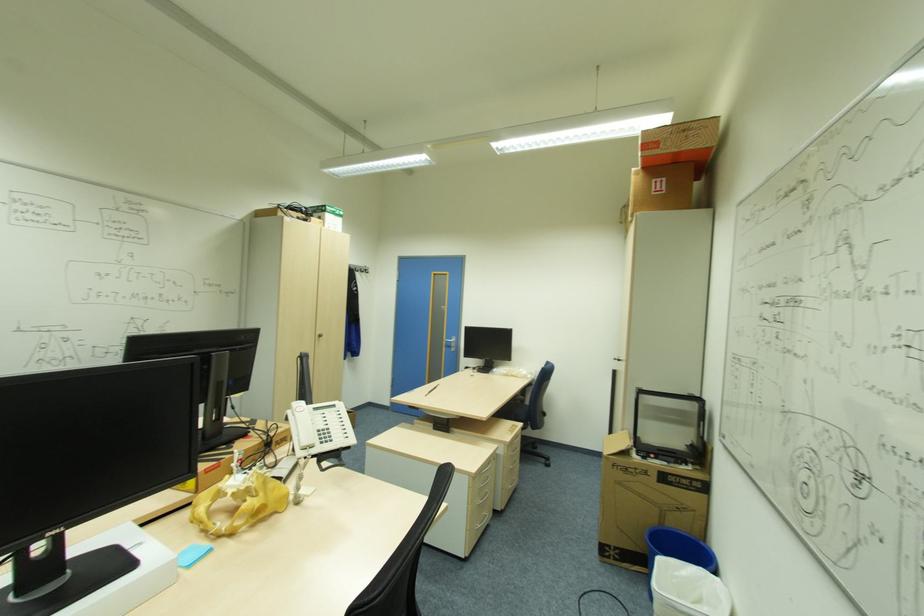
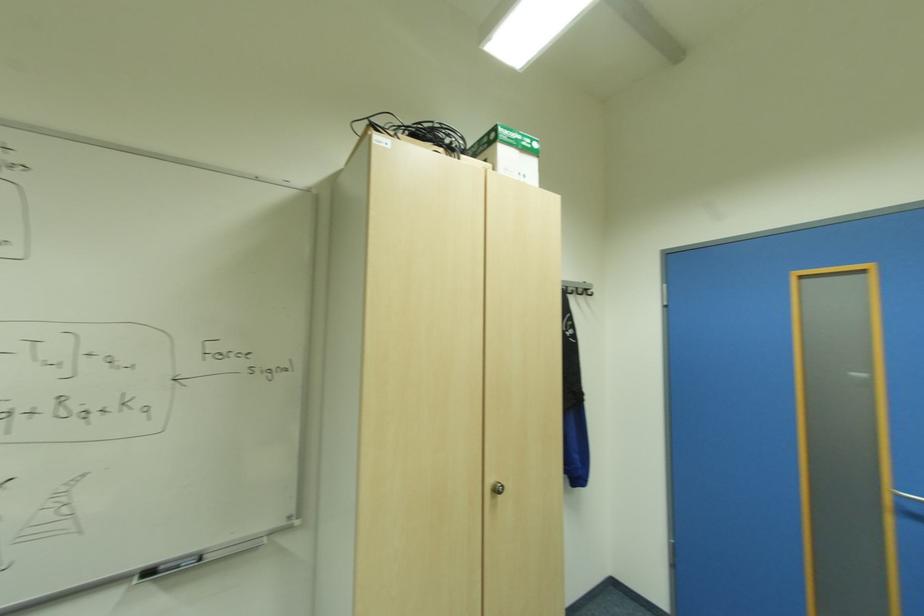
The point at (368, 270) is marked in the first image. Where is the corresponding point in the second image?

(588, 291)